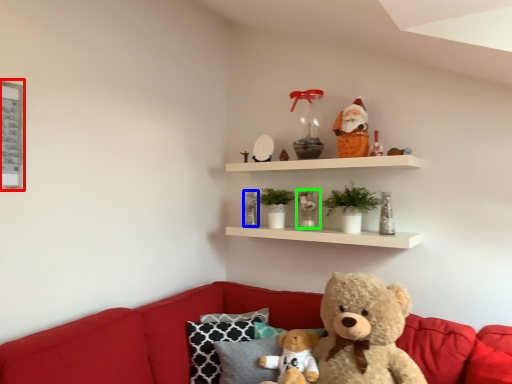
Question: Considering the real-world distances, which object is farthest from picture frame (highlighted by a red box)? toy (highlighted by a blue box) or toy (highlighted by a green box)?

Choices:
 (A) toy
 (B) toy

Answer: (B)